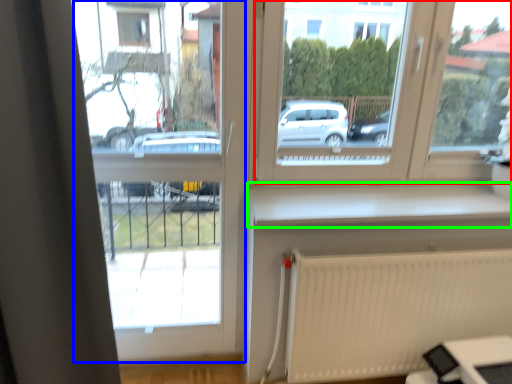
Question: Which is farther away from window (highlighted by a red box)? window frame (highlighted by a blue box) or window sill (highlighted by a green box)?

Choices:
 (A) window frame
 (B) window sill

Answer: (A)